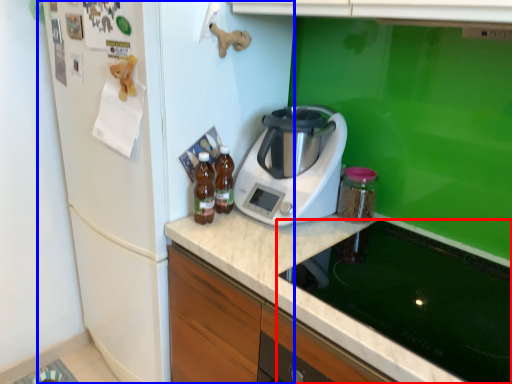
Question: Which object is further to the camera taking this photo, home appliance (highlighted by a red box) or fridge (highlighted by a blue box)?

Choices:
 (A) home appliance
 (B) fridge

Answer: (B)